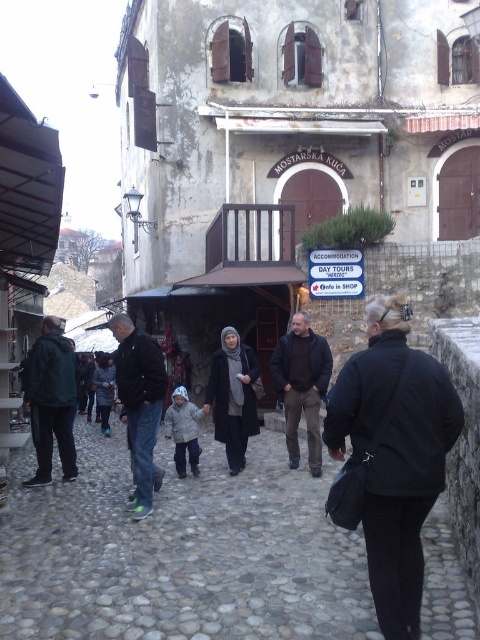
You are standing in front of MOSTARSKA KUCA and want to find the entrance. There is a point marked at coordinates (139, 403) on dark blue jeans at center. Is this point near the entrance?

The point at (139, 403) is on dark blue jeans at center, which is not near the entrance of MOSTARSKA KUCA. The entrance is below the balcony with a dark wooden railing above it.

You are a traveler trying to decide which coat to take for your walk around the historic town. The dark brown leather jacket at center and the dark gray woolen coat at lower left are both available. Based on their sizes, which one might be more suitable for carrying a backpack?

The dark brown leather jacket at center is wider than the dark gray woolen coat at lower left, so it might be more suitable for carrying a backpack as it allows more space for movement.